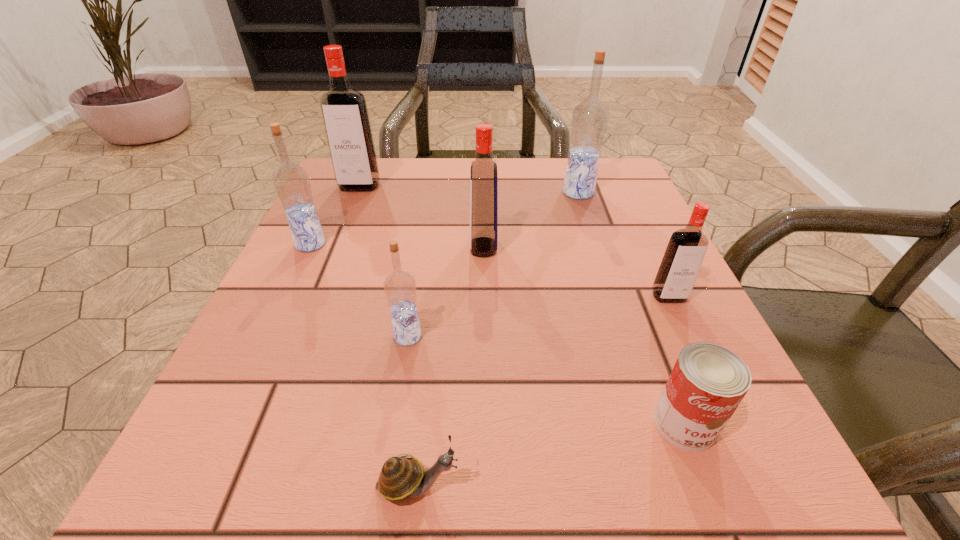
Locate an element on the screen. The width and height of the screenshot is (960, 540). free point between the leftmost red vodka and the rightmost blue vodka is located at coordinates click(x=468, y=189).

You are a GUI agent. You are given a task and a screenshot of the screen. Output one action in this format:
    pyautogui.click(x=<x>, y=<y>)
    Task: Click on the free space between the seventh tallest object and the second biggest blue vodka
    This screenshot has height=540, width=960.
    Given the screenshot: What is the action you would take?
    pyautogui.click(x=497, y=334)

At what (x,y) coordinates should I click in order to perform the action: click on empty space between the second shortest object and the gray snail. Please return your answer as a coordinate pair (x, y). This screenshot has width=960, height=540. Looking at the image, I should click on 551,455.

Identify the location of free area in between the nearest object and the fifth farthest object. The image size is (960, 540). (543, 391).

Identify the location of free space between the farthest red vodka and the leftmost blue vodka. This screenshot has width=960, height=540. (335, 215).

The width and height of the screenshot is (960, 540). In order to click on vacant area that lies between the second red vodka from right to left and the second blue vodka from right to left in this screenshot , I will do `click(445, 292)`.

This screenshot has width=960, height=540. Identify the location of vacant area that lies between the leftmost blue vodka and the seventh farthest object. (497, 334).

Image resolution: width=960 pixels, height=540 pixels. I want to click on object that is the seventh closest to the second blue vodka from left to right, so click(x=589, y=120).

You are a GUI agent. You are given a task and a screenshot of the screen. Output one action in this format:
    pyautogui.click(x=<x>, y=<y>)
    Task: Click on the closest object relative to the rightmost red vodka
    This screenshot has width=960, height=540.
    Given the screenshot: What is the action you would take?
    pyautogui.click(x=708, y=382)

Identify which vodka is the third closest to the farthest red vodka. Please provide its 2D coordinates. Your answer should be formatted as a tuple, i.e. [(x, y)], where the tuple contains the x and y coordinates of a point satisfying the conditions above.

[(589, 120)]